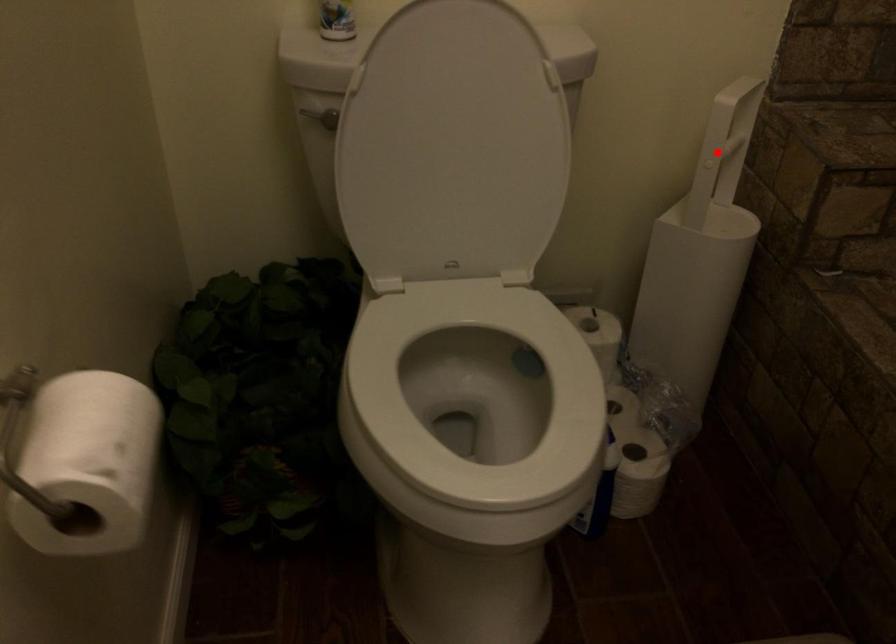
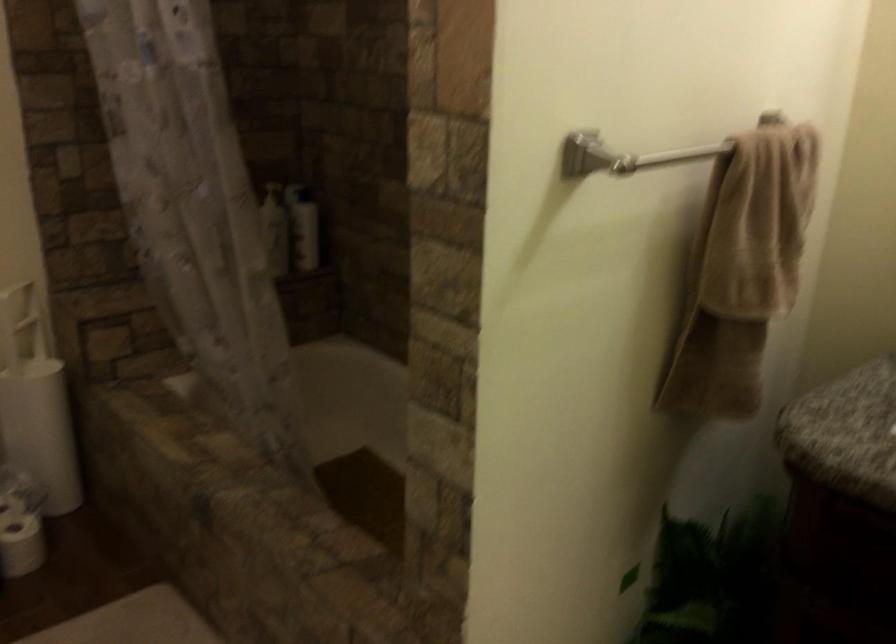
Where in the second image is the point corresponding to the highlighted location from the first image?

(20, 323)